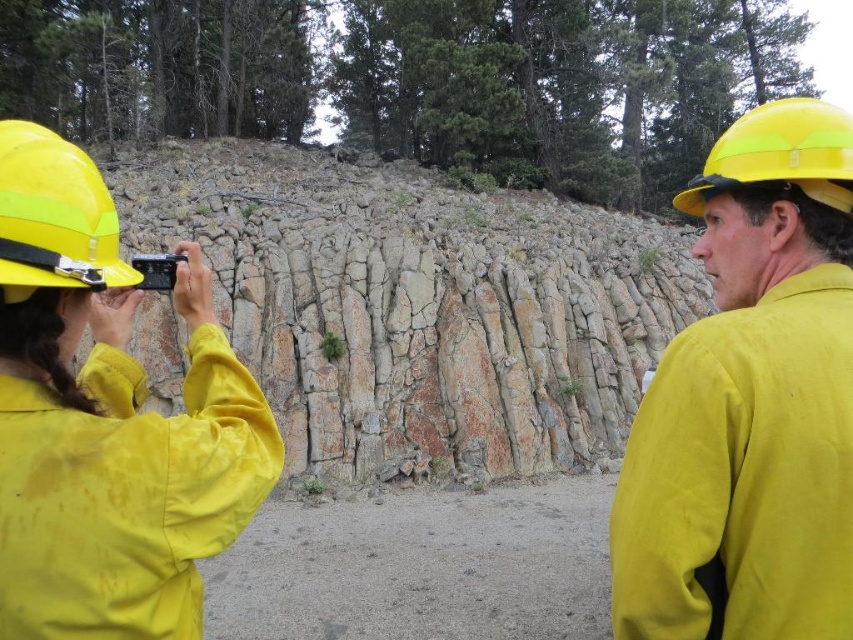
Does yellow hard hat at left have a greater height compared to yellow matte helmet at upper right?

Incorrect, yellow hard hat at left's height is not larger of yellow matte helmet at upper right's.

Can you confirm if yellow hard hat at left is bigger than yellow matte helmet at upper right?

No.

Find the location of a particular element. yellow hard hat at left is located at coordinates (54, 216).

Which is more to the left, yellow matte hard hat at left or yellow hard hat at left?

Positioned to the left is yellow hard hat at left.

Who is lower down, yellow matte hard hat at left or yellow hard hat at left?

yellow matte hard hat at left is below.

The height and width of the screenshot is (640, 853). In order to click on yellow matte hard hat at left in this screenshot , I will do `click(107, 419)`.

Between point (241, 365) and point (692, 193), which one is positioned in front?

Point (241, 365)

Between yellow matte hard hat at left and yellow matte helmet at upper right, which one appears on the right side from the viewer's perspective?

yellow matte helmet at upper right is more to the right.

This screenshot has height=640, width=853. Find the location of `yellow matte hard hat at left`. yellow matte hard hat at left is located at coordinates (107, 419).

At what (x,y) coordinates should I click in order to perform the action: click on yellow matte hard hat at left. Please return your answer as a coordinate pair (x, y). Looking at the image, I should click on (107, 419).